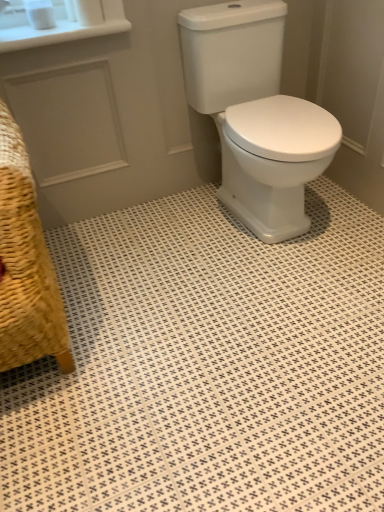
The height and width of the screenshot is (512, 384). In order to click on white matte toilet paper at upper left, the 2th toilet paper from the right in this screenshot , I will do `click(40, 14)`.

Measure the distance between white glossy ceramic tile at center and camera.

38.36 inches.

What do you see at coordinates (255, 113) in the screenshot? I see `white glossy porcelain at center` at bounding box center [255, 113].

This screenshot has width=384, height=512. Find the location of `white matte toilet paper at upper left, the 2th toilet paper from the right`. white matte toilet paper at upper left, the 2th toilet paper from the right is located at coordinates (40, 14).

How far apart are white glossy porcelain at center and white matte toilet paper at upper left, which is the first toilet paper in left-to-right order?

white glossy porcelain at center is 33.38 inches away from white matte toilet paper at upper left, which is the first toilet paper in left-to-right order.

Is white glossy porcelain at center oriented away from white matte toilet paper at upper left, the 2th toilet paper from the right?

No, white matte toilet paper at upper left, the 2th toilet paper from the right, is not at the back of white glossy porcelain at center.

Is point (190, 10) less distant than point (48, 14)?

That is True.

What's the angular difference between white glossy porcelain at center and white matte toilet paper at upper left, which is the first toilet paper in left-to-right order,'s facing directions?

white glossy porcelain at center and white matte toilet paper at upper left, which is the first toilet paper in left-to-right order, are facing 1.43 degrees away from each other.

Is white matte toilet paper at upper left, which is the first toilet paper in left-to-right order, positioned before woven straw armchair at lower left?

No, white matte toilet paper at upper left, which is the first toilet paper in left-to-right order, is further to the viewer.

From the image's perspective, which is above, white matte toilet paper at upper left, which is the first toilet paper in left-to-right order, or woven straw armchair at lower left?

white matte toilet paper at upper left, which is the first toilet paper in left-to-right order.

Considering the sizes of objects white matte toilet paper at upper left, the 2th toilet paper from the right, and woven straw armchair at lower left in the image provided, who is shorter, white matte toilet paper at upper left, the 2th toilet paper from the right, or woven straw armchair at lower left?

white matte toilet paper at upper left, the 2th toilet paper from the right, is shorter.

From a real-world perspective, is white matte toilet paper at upper left, which is the 2th toilet paper in left-to-right order, physically above white glossy porcelain at center?

Yes, from a real-world perspective, white matte toilet paper at upper left, which is the 2th toilet paper in left-to-right order, is on top of white glossy porcelain at center.

Which of these two, white matte toilet paper at upper left, acting as the first toilet paper starting from the right, or white glossy porcelain at center, is bigger?

white glossy porcelain at center is bigger.

How distant is white matte toilet paper at upper left, which is the 2th toilet paper in left-to-right order, from white glossy porcelain at center?

white matte toilet paper at upper left, which is the 2th toilet paper in left-to-right order, and white glossy porcelain at center are 26.03 inches apart.

Is white matte toilet paper at upper left, which is the 2th toilet paper in left-to-right order, facing towards white glossy porcelain at center?

No, white matte toilet paper at upper left, which is the 2th toilet paper in left-to-right order, does not turn towards white glossy porcelain at center.

What's the angular difference between white glossy porcelain at center and white matte toilet paper at upper left, acting as the first toilet paper starting from the right,'s facing directions?

The angular difference between white glossy porcelain at center and white matte toilet paper at upper left, acting as the first toilet paper starting from the right, is 1.43 degrees.

Measure the distance from white glossy porcelain at center to white matte toilet paper at upper left, which is the 2th toilet paper in left-to-right order.

white glossy porcelain at center and white matte toilet paper at upper left, which is the 2th toilet paper in left-to-right order, are 26.03 inches apart.

Could you tell me if white glossy porcelain at center is facing white matte toilet paper at upper left, which is the 2th toilet paper in left-to-right order?

No.

Does white glossy porcelain at center have a lesser height compared to white matte toilet paper at upper left, which is the 2th toilet paper in left-to-right order?

In fact, white glossy porcelain at center may be taller than white matte toilet paper at upper left, which is the 2th toilet paper in left-to-right order.

Visually, is white glossy porcelain at center positioned to the left or to the right of white glossy ceramic tile at center?

white glossy porcelain at center is positioned on white glossy ceramic tile at center's right side.

Is white glossy porcelain at center far from white glossy ceramic tile at center?

Actually, white glossy porcelain at center and white glossy ceramic tile at center are a little close together.

Considering their positions, is white glossy porcelain at center located in front of or behind white glossy ceramic tile at center?

Clearly, white glossy porcelain at center is behind white glossy ceramic tile at center.

From a real-world perspective, who is located higher, white glossy porcelain at center or white glossy ceramic tile at center?

white glossy porcelain at center, from a real-world perspective.

From a real-world perspective, is white matte toilet paper at upper left, which is the 2th toilet paper in left-to-right order, physically above white glossy ceramic tile at center?

Yes, from a real-world perspective, white matte toilet paper at upper left, which is the 2th toilet paper in left-to-right order, is on top of white glossy ceramic tile at center.

Locate an element on the screen. This screenshot has width=384, height=512. ceramic tile directly beneath the white matte toilet paper at upper left, acting as the first toilet paper starting from the right (from a real-world perspective) is located at coordinates (207, 365).

How many degrees apart are the facing directions of white matte toilet paper at upper left, which is the 2th toilet paper in left-to-right order, and white glossy ceramic tile at center?

0.579 degrees.

Is there a large distance between white matte toilet paper at upper left, acting as the first toilet paper starting from the right, and white glossy ceramic tile at center?

white matte toilet paper at upper left, acting as the first toilet paper starting from the right, is positioned a significant distance from white glossy ceramic tile at center.

Does white matte toilet paper at upper left, the 2th toilet paper from the right, come behind white glossy porcelain at center?

Yes, white matte toilet paper at upper left, the 2th toilet paper from the right, is further from the camera.

Measure the distance between white matte toilet paper at upper left, which is the first toilet paper in left-to-right order, and white glossy porcelain at center.

The distance of white matte toilet paper at upper left, which is the first toilet paper in left-to-right order, from white glossy porcelain at center is 33.38 inches.

Is white matte toilet paper at upper left, which is the first toilet paper in left-to-right order, positioned with its back to white glossy porcelain at center?

No.

I want to click on porcelain below the white matte toilet paper at upper left, which is the first toilet paper in left-to-right order (from a real-world perspective), so 255,113.

I want to click on porcelain below the white matte toilet paper at upper left, the 2th toilet paper from the right (from a real-world perspective), so click(x=255, y=113).

From the image's perspective, count 1st toilet papers upward from the woven straw armchair at lower left and point to it. Please provide its 2D coordinates.

[(40, 14)]

When comparing their distances from woven straw armchair at lower left, does white matte toilet paper at upper left, acting as the first toilet paper starting from the right, or white matte toilet paper at upper left, the 2th toilet paper from the right, seem closer?

white matte toilet paper at upper left, acting as the first toilet paper starting from the right, is positioned closer to the anchor woven straw armchair at lower left.

Which object lies further to the anchor point white matte toilet paper at upper left, which is the 2th toilet paper in left-to-right order, white glossy ceramic tile at center or white glossy porcelain at center?

white glossy ceramic tile at center.

Based on their spatial positions, is white matte toilet paper at upper left, acting as the first toilet paper starting from the right, or woven straw armchair at lower left further from white glossy porcelain at center?

woven straw armchair at lower left is positioned further to the anchor white glossy porcelain at center.

Based on their spatial positions, is white matte toilet paper at upper left, which is the first toilet paper in left-to-right order, or white glossy ceramic tile at center closer to white glossy porcelain at center?

white glossy ceramic tile at center.

Estimate the real-world distances between objects in this image. Which object is further from white glossy ceramic tile at center, white glossy porcelain at center or white matte toilet paper at upper left, which is the 2th toilet paper in left-to-right order?

white matte toilet paper at upper left, which is the 2th toilet paper in left-to-right order.

Based on their spatial positions, is white matte toilet paper at upper left, the 2th toilet paper from the right, or white glossy porcelain at center closer to white matte toilet paper at upper left, which is the 2th toilet paper in left-to-right order?

Among the two, white matte toilet paper at upper left, the 2th toilet paper from the right, is located nearer to white matte toilet paper at upper left, which is the 2th toilet paper in left-to-right order.

When comparing their distances from woven straw armchair at lower left, does white glossy porcelain at center or white matte toilet paper at upper left, which is the 2th toilet paper in left-to-right order, seem further?

Based on the image, white matte toilet paper at upper left, which is the 2th toilet paper in left-to-right order, appears to be further to woven straw armchair at lower left.

Looking at the image, which one is located further to white matte toilet paper at upper left, which is the 2th toilet paper in left-to-right order, white glossy porcelain at center or white matte toilet paper at upper left, the 2th toilet paper from the right?

The object further to white matte toilet paper at upper left, which is the 2th toilet paper in left-to-right order, is white glossy porcelain at center.

The height and width of the screenshot is (512, 384). In order to click on porcelain between white matte toilet paper at upper left, acting as the first toilet paper starting from the right, and white glossy ceramic tile at center from top to bottom in this screenshot , I will do coord(255,113).

I want to click on ceramic tile between woven straw armchair at lower left and white glossy porcelain at center from left to right, so click(207, 365).

At what (x,y) coordinates should I click in order to perform the action: click on armchair between white matte toilet paper at upper left, the 2th toilet paper from the right, and white glossy ceramic tile at center in the up-down direction. Please return your answer as a coordinate pair (x, y). The width and height of the screenshot is (384, 512). Looking at the image, I should click on (26, 265).

Identify the location of toilet paper between white matte toilet paper at upper left, which is the 2th toilet paper in left-to-right order, and woven straw armchair at lower left in the up-down direction. (40, 14).